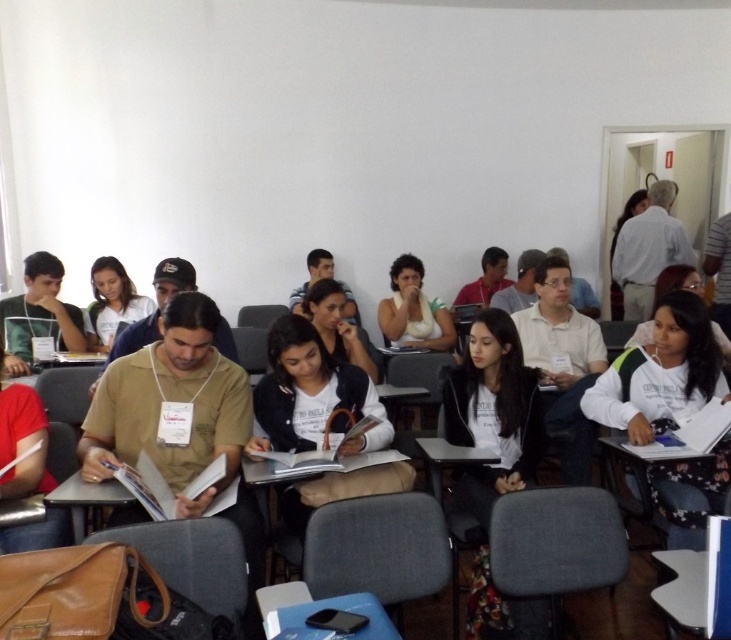
You are a student sitting in the classroom and want to reach both the point at (678, 557) and the point at (360, 627). Which point is closer to you?

Point (360, 627) is closer to you because it is nearer than point (678, 557), which is further away.

In the scene shown: You are standing at the entrance of the classroom and want to locate the white cotton shirt at lower right. According to the coordinates provided, where exactly should you look to find it?

The white cotton shirt at lower right is located at coordinates point (662,372).